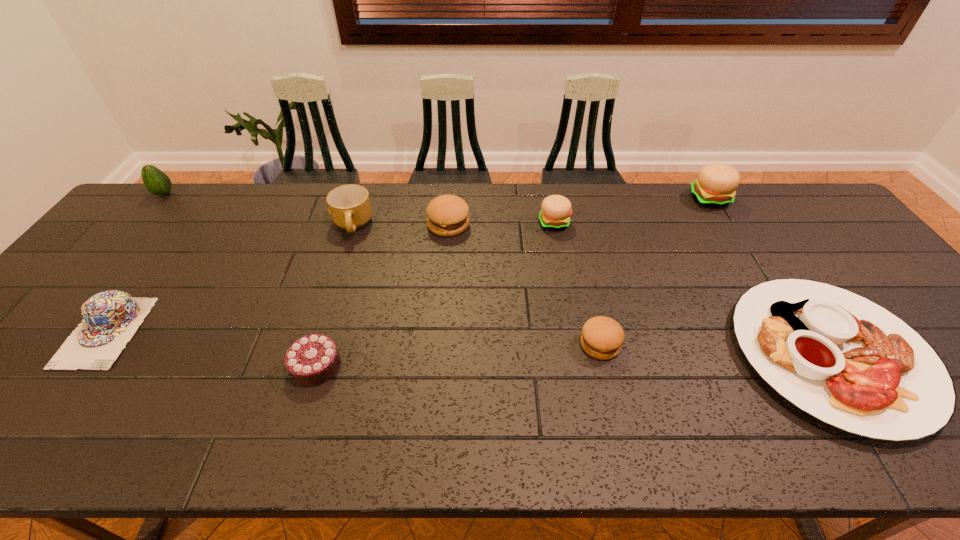
Find the location of a particular element. The height and width of the screenshot is (540, 960). vacant space situated 0.080m on the front of the right brown hamburger is located at coordinates (612, 393).

Identify the location of avocado at the far edge. Image resolution: width=960 pixels, height=540 pixels. (156, 181).

This screenshot has width=960, height=540. Identify the location of mug that is at the far edge. (350, 208).

What are the coordinates of `avocado at the left edge` in the screenshot? It's located at (156, 181).

Where is `cap that is at the left edge`? This screenshot has width=960, height=540. cap that is at the left edge is located at coordinates (111, 318).

This screenshot has height=540, width=960. Identify the location of object that is at the far left corner. (156, 181).

Identify the location of free space at the far edge of the desktop. The width and height of the screenshot is (960, 540). (408, 227).

In the image, there is a desktop. Identify the location of vacant space at the near edge. (73, 439).

Find the location of `free region at the right edge`. free region at the right edge is located at coordinates (833, 268).

At what (x,y) coordinates should I click in order to perform the action: click on vacant space that's between the nearer beige hamburger and the cap. Please return your answer as a coordinate pair (x, y). The image size is (960, 540). Looking at the image, I should click on (330, 277).